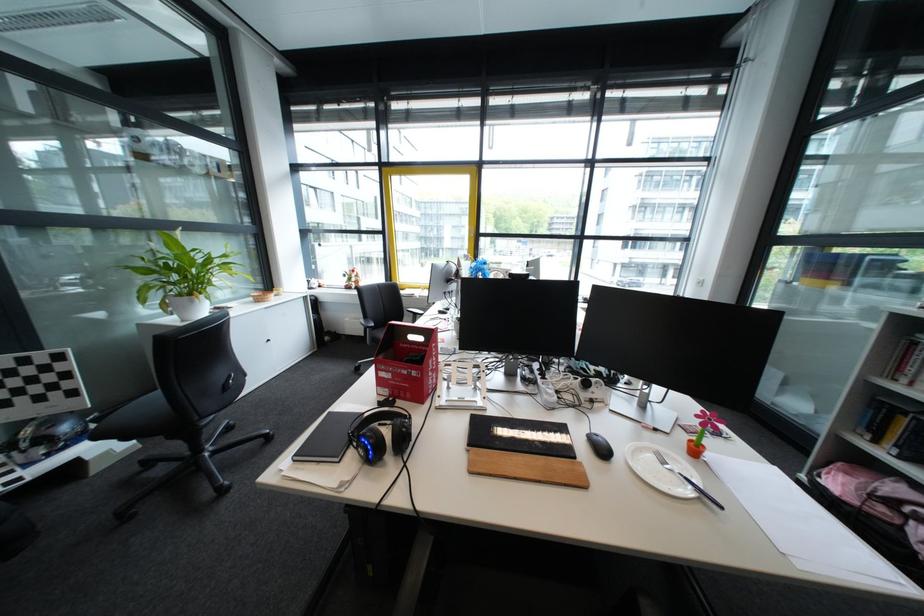
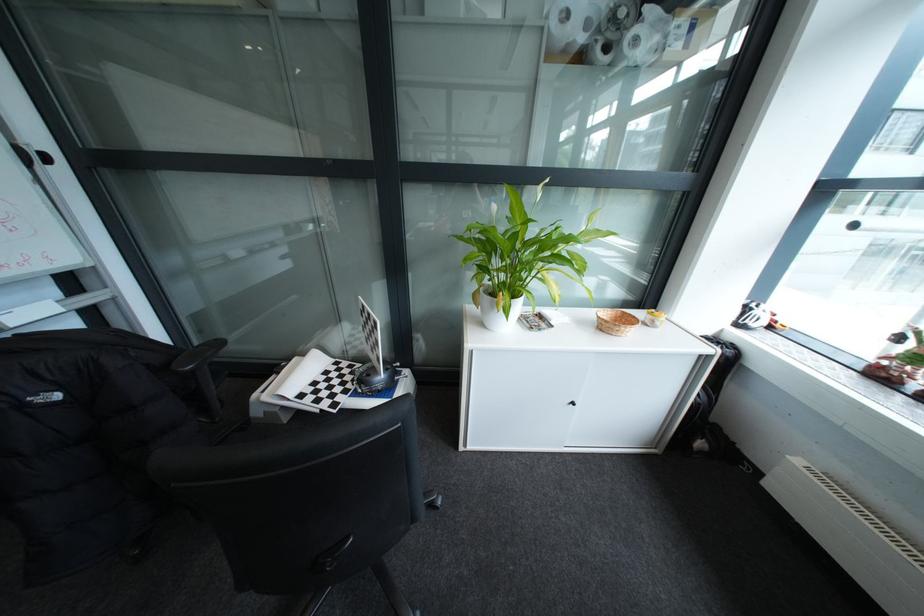
Where in the second image is the point corresponding to pixel 273 302 from the first image?

(614, 331)